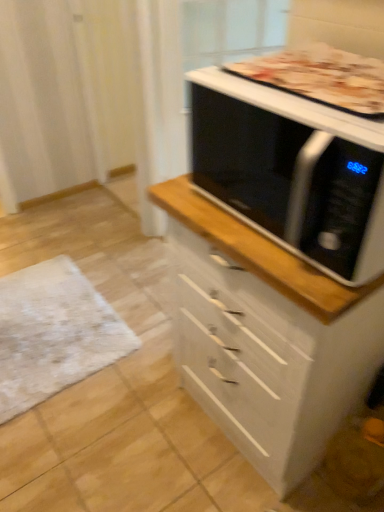
Question: Considering the relative sizes of black glossy microwave at upper right and white textured mat at lower left in the image provided, is black glossy microwave at upper right thinner than white textured mat at lower left?

Choices:
 (A) yes
 (B) no

Answer: (A)

Question: Considering the relative positions of black glossy microwave at upper right and white textured mat at lower left in the image provided, is black glossy microwave at upper right behind white textured mat at lower left?

Choices:
 (A) yes
 (B) no

Answer: (B)

Question: Is black glossy microwave at upper right turned away from white textured mat at lower left?

Choices:
 (A) yes
 (B) no

Answer: (B)

Question: From a real-world perspective, is black glossy microwave at upper right physically below white textured mat at lower left?

Choices:
 (A) no
 (B) yes

Answer: (A)

Question: From a real-world perspective, does black glossy microwave at upper right stand above white textured mat at lower left?

Choices:
 (A) yes
 (B) no

Answer: (A)

Question: Can you confirm if black glossy microwave at upper right is shorter than white textured mat at lower left?

Choices:
 (A) no
 (B) yes

Answer: (A)

Question: Would you say white textured mat at lower left is outside golden brown crust at upper right?

Choices:
 (A) no
 (B) yes

Answer: (B)

Question: Does white textured mat at lower left come behind golden brown crust at upper right?

Choices:
 (A) no
 (B) yes

Answer: (B)

Question: Is white textured mat at lower left smaller than golden brown crust at upper right?

Choices:
 (A) no
 (B) yes

Answer: (A)

Question: Is white textured mat at lower left looking in the opposite direction of golden brown crust at upper right?

Choices:
 (A) no
 (B) yes

Answer: (A)

Question: Is white textured mat at lower left closer to the viewer compared to golden brown crust at upper right?

Choices:
 (A) no
 (B) yes

Answer: (A)

Question: Does white textured mat at lower left have a lesser width compared to golden brown crust at upper right?

Choices:
 (A) no
 (B) yes

Answer: (A)

Question: Considering the relative positions of golden brown crust at upper right and white glossy chest of drawers at center in the image provided, is golden brown crust at upper right to the right of white glossy chest of drawers at center from the viewer's perspective?

Choices:
 (A) no
 (B) yes

Answer: (B)